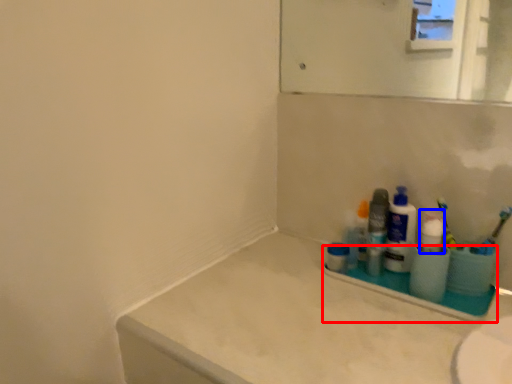
Question: Which object is further to the camera taking this photo, window sill (highlighted by a red box) or cleaning product (highlighted by a blue box)?

Choices:
 (A) window sill
 (B) cleaning product

Answer: (B)